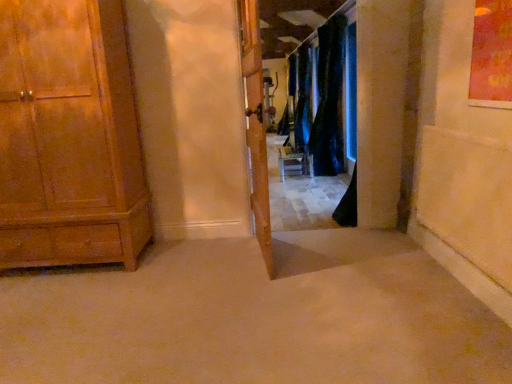
Question: Would you say black velvet curtain at center, which is the second curtain from back to front, is outside wooden cabinet at left?

Choices:
 (A) no
 (B) yes

Answer: (B)

Question: Considering the relative positions of black velvet curtain at center, which is counted as the 1th curtain, starting from the front, and wooden cabinet at left in the image provided, is black velvet curtain at center, which is counted as the 1th curtain, starting from the front, to the left of wooden cabinet at left from the viewer's perspective?

Choices:
 (A) yes
 (B) no

Answer: (B)

Question: From the image's perspective, is black velvet curtain at center, which is the second curtain from back to front, beneath wooden cabinet at left?

Choices:
 (A) no
 (B) yes

Answer: (A)

Question: Is black velvet curtain at center, which is the second curtain from back to front, closer to the viewer compared to wooden cabinet at left?

Choices:
 (A) no
 (B) yes

Answer: (A)

Question: Can wooden cabinet at left be found inside black velvet curtain at center, which is counted as the 1th curtain, starting from the front?

Choices:
 (A) no
 (B) yes

Answer: (A)

Question: Can you confirm if black velvet curtain at center, which is counted as the 1th curtain, starting from the front, is taller than wooden cabinet at left?

Choices:
 (A) no
 (B) yes

Answer: (B)

Question: Is wooden door at center surrounding black velvet curtain at center, which is the second curtain from back to front?

Choices:
 (A) no
 (B) yes

Answer: (A)

Question: From the image's perspective, is wooden door at center below black velvet curtain at center, which is the second curtain from back to front?

Choices:
 (A) yes
 (B) no

Answer: (A)

Question: Is wooden door at center touching black velvet curtain at center, which is counted as the 1th curtain, starting from the front?

Choices:
 (A) no
 (B) yes

Answer: (A)

Question: Is wooden door at center bigger than black velvet curtain at center, which is the second curtain from back to front?

Choices:
 (A) yes
 (B) no

Answer: (B)

Question: Is wooden door at center positioned beyond the bounds of black velvet curtain at center, which is the second curtain from back to front?

Choices:
 (A) yes
 (B) no

Answer: (A)

Question: Can you confirm if wooden door at center is wider than black velvet curtain at center, which is the second curtain from back to front?

Choices:
 (A) no
 (B) yes

Answer: (A)

Question: From the image's perspective, does wooden door at center appear lower than dark blue velvet curtains at center, arranged as the 1th curtain when viewed from the back?

Choices:
 (A) yes
 (B) no

Answer: (A)